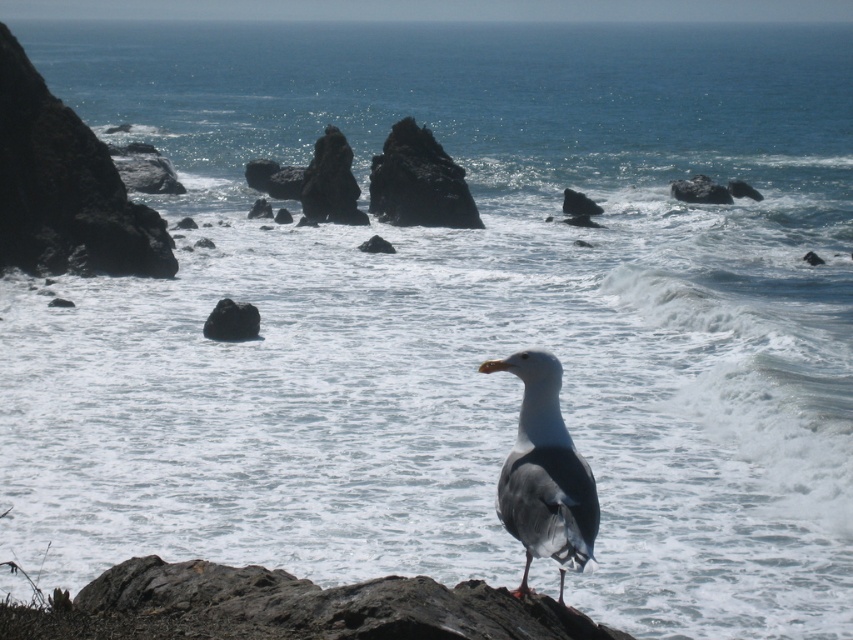
Can you confirm if gray matte seagull at center is wider than rough textured rock at center?

No.

This screenshot has width=853, height=640. Describe the element at coordinates (544, 474) in the screenshot. I see `gray matte seagull at center` at that location.

You are a GUI agent. You are given a task and a screenshot of the screen. Output one action in this format:
    pyautogui.click(x=<x>, y=<y>)
    Task: Click on the gray matte seagull at center
    
    Given the screenshot: What is the action you would take?
    pyautogui.click(x=544, y=474)